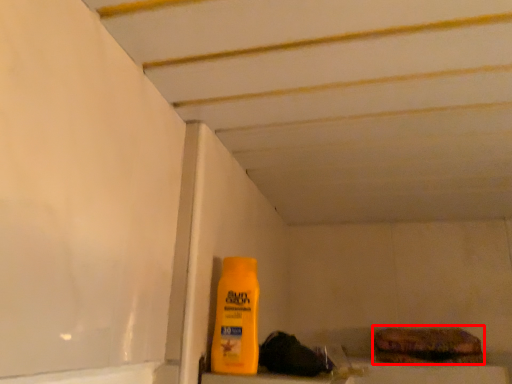
Question: From the image's perspective, what is the correct spatial relationship of food (annotated by the red box) in relation to bottle?

Choices:
 (A) above
 (B) below

Answer: (B)